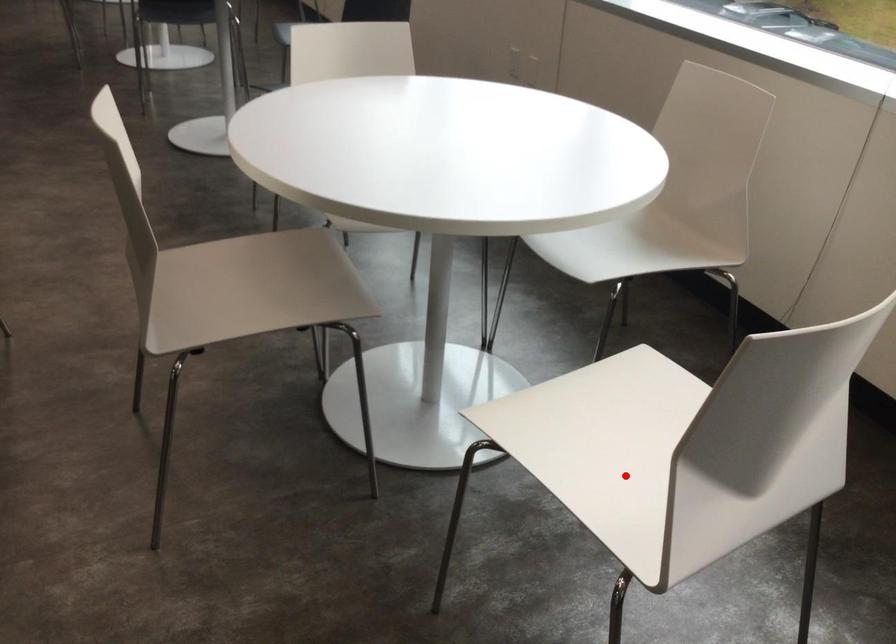
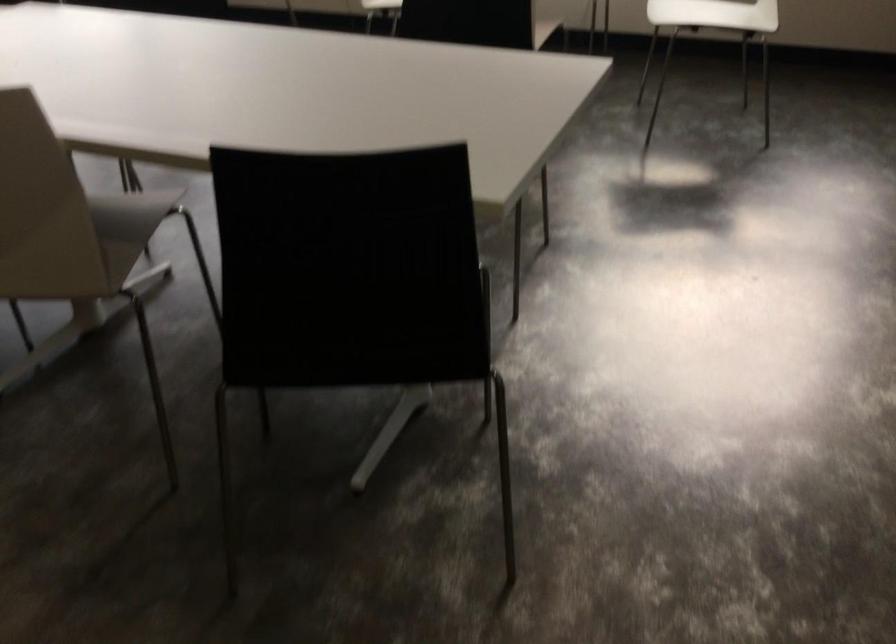
Question: I am providing you with two images of the same scene from different viewpoints. Image1 has a red point marked. In image2, the corresponding 3D location appears at what relative position? Reply with the corresponding letter.

Choices:
 (A) Closer
 (B) Farther

Answer: (B)